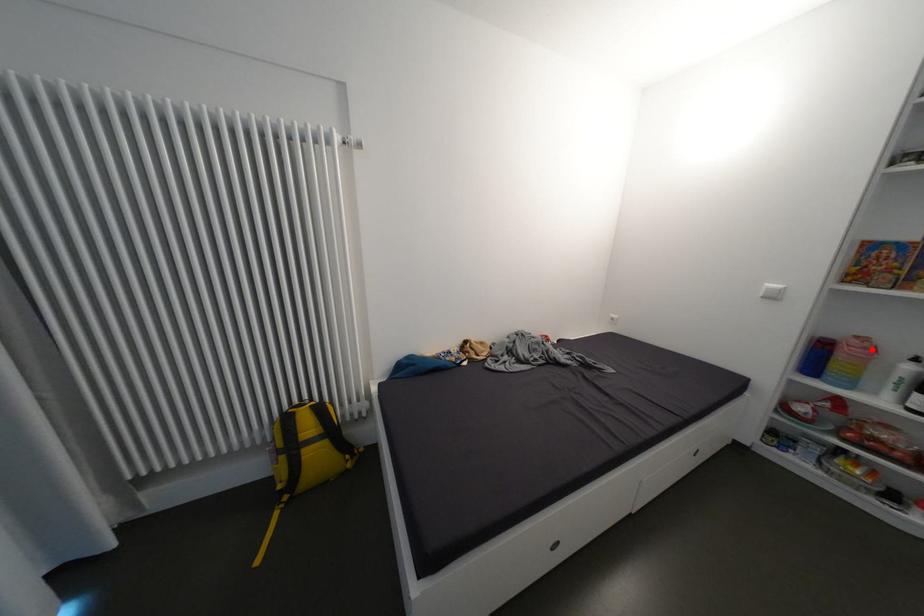
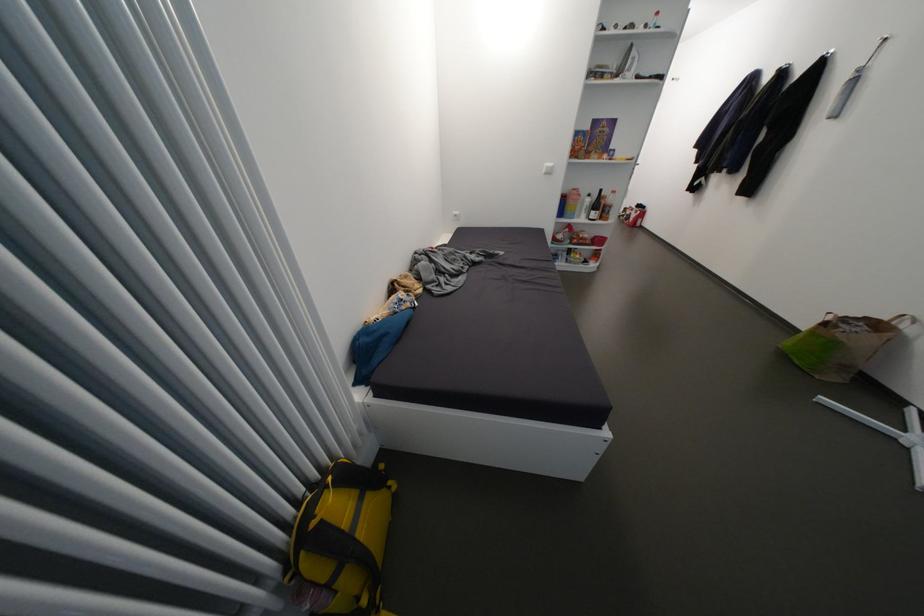
Locate, in the second image, the point that corresponds to the highlighted location in the first image.

(585, 196)